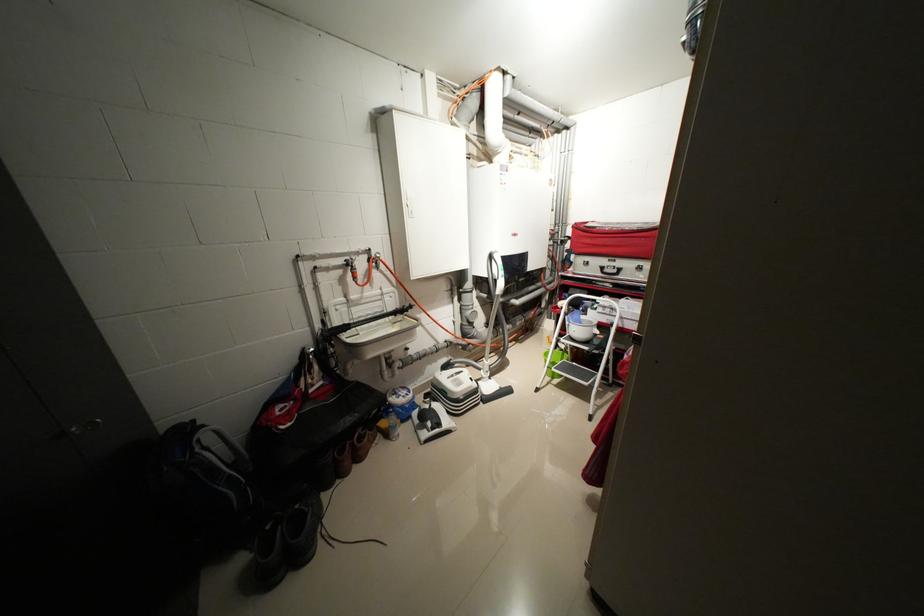
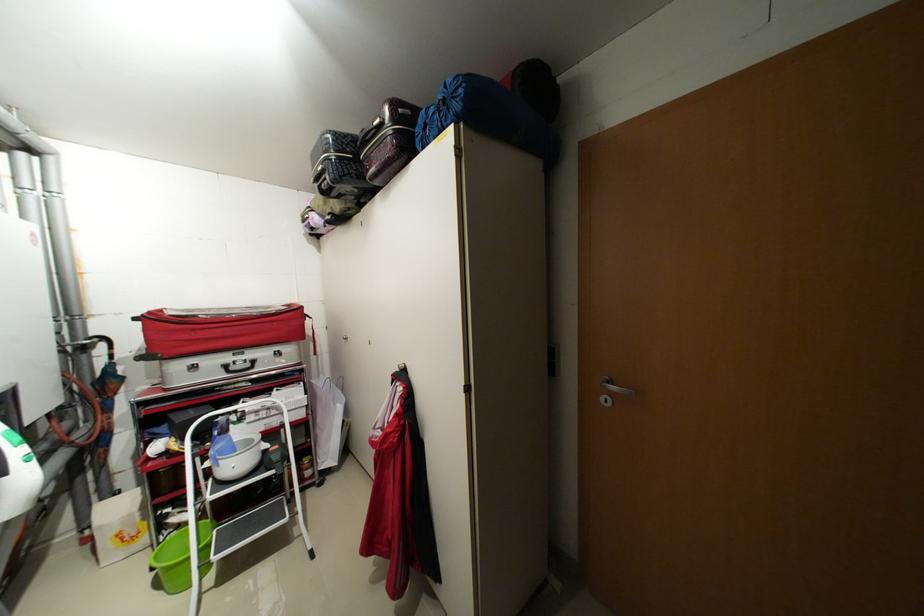
Question: The images are taken continuously from a first-person perspective. In which direction is your viewpoint rotating?

Choices:
 (A) Left
 (B) Right
 (C) Up
 (D) Down

Answer: (B)